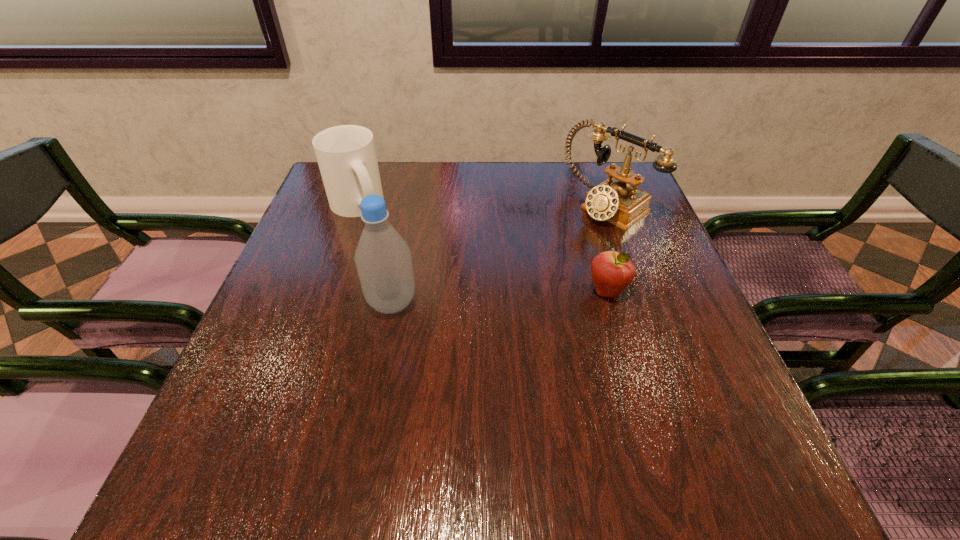
Identify the location of the tallest object. (383, 260).

Where is `the third object from right to left`? the third object from right to left is located at coordinates (383, 260).

This screenshot has height=540, width=960. I want to click on apple, so click(612, 272).

Locate an element on the screen. This screenshot has width=960, height=540. the third tallest object is located at coordinates (346, 155).

Image resolution: width=960 pixels, height=540 pixels. Find the location of `mug`. mug is located at coordinates (346, 155).

The width and height of the screenshot is (960, 540). What are the coordinates of `the third shortest object` in the screenshot? It's located at (614, 200).

This screenshot has width=960, height=540. I want to click on free space located 0.290m on the back of the second object from left to right, so click(410, 209).

I want to click on free point located on the back of the shortest object, so click(x=580, y=195).

Locate an element on the screen. The image size is (960, 540). vacant space located 0.290m on the handle side of the third tallest object is located at coordinates (443, 275).

The width and height of the screenshot is (960, 540). In order to click on free space located 0.350m on the handle side of the third tallest object in this screenshot , I will do `click(461, 289)`.